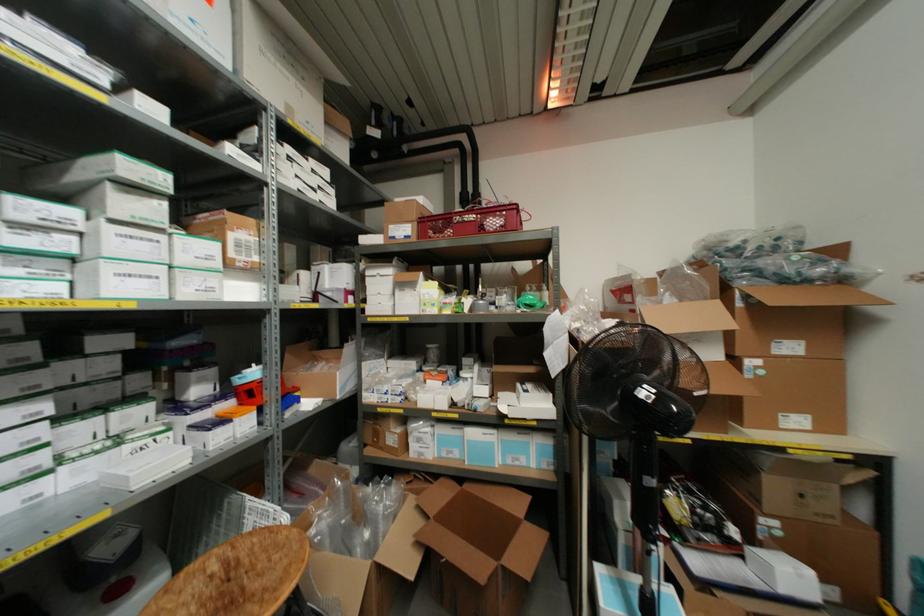
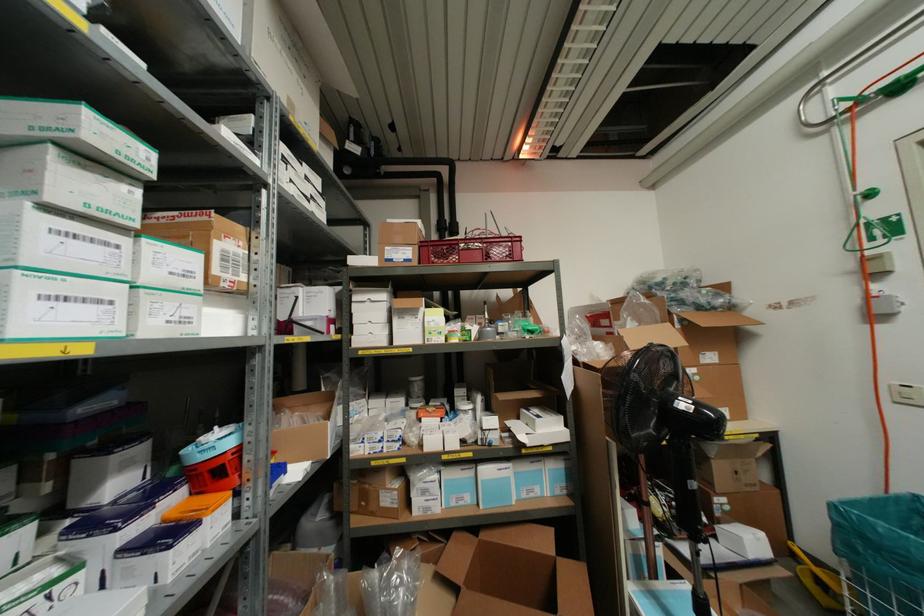
Locate, in the second image, the point that corresponds to [171,191] in the first image.

(152, 176)